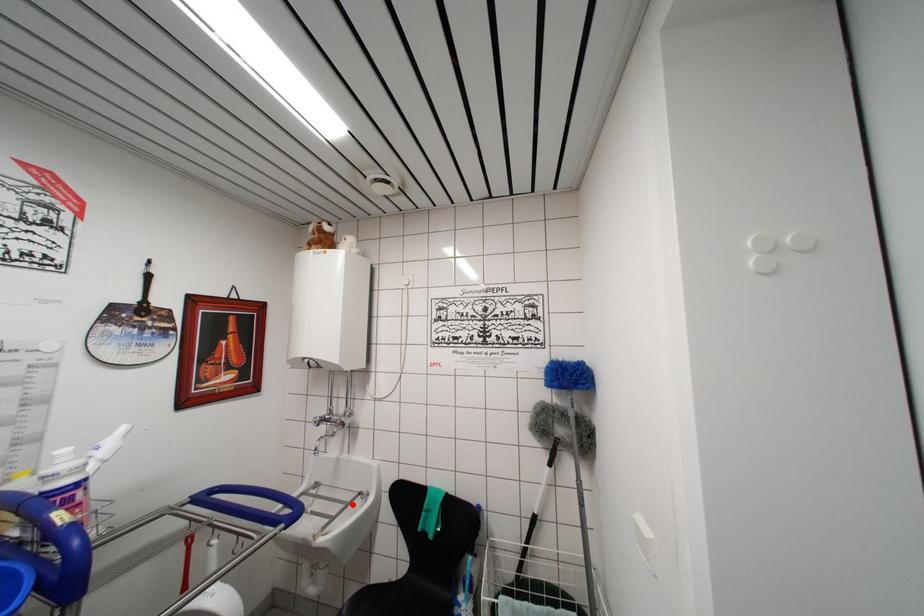
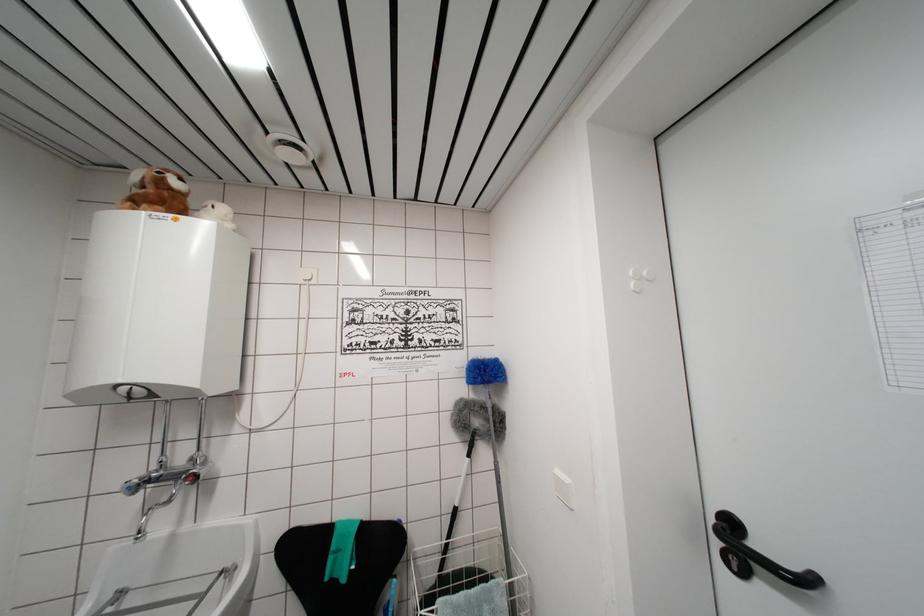
Locate, in the second image, the point that corresponds to the highlighted location in the first image.

(209, 593)